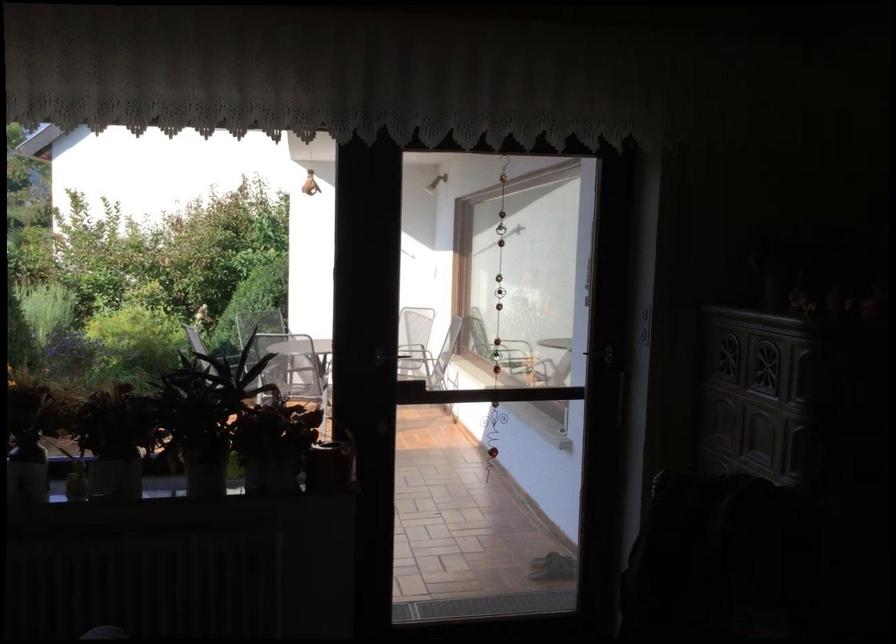
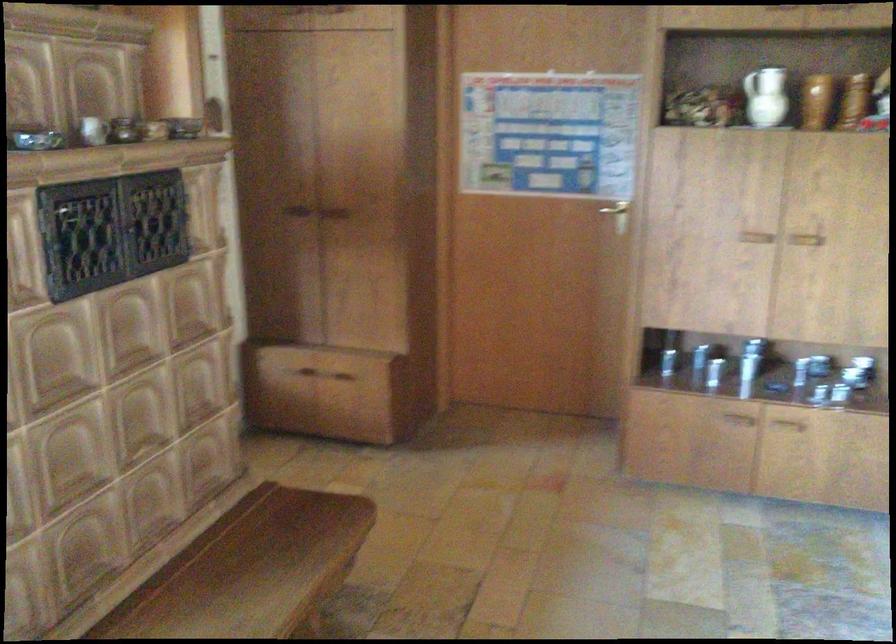
Question: Based on the continuous images, in which direction is the camera rotating? Reply with the corresponding letter.

Choices:
 (A) Left
 (B) Right
 (C) Up
 (D) Down

Answer: (B)